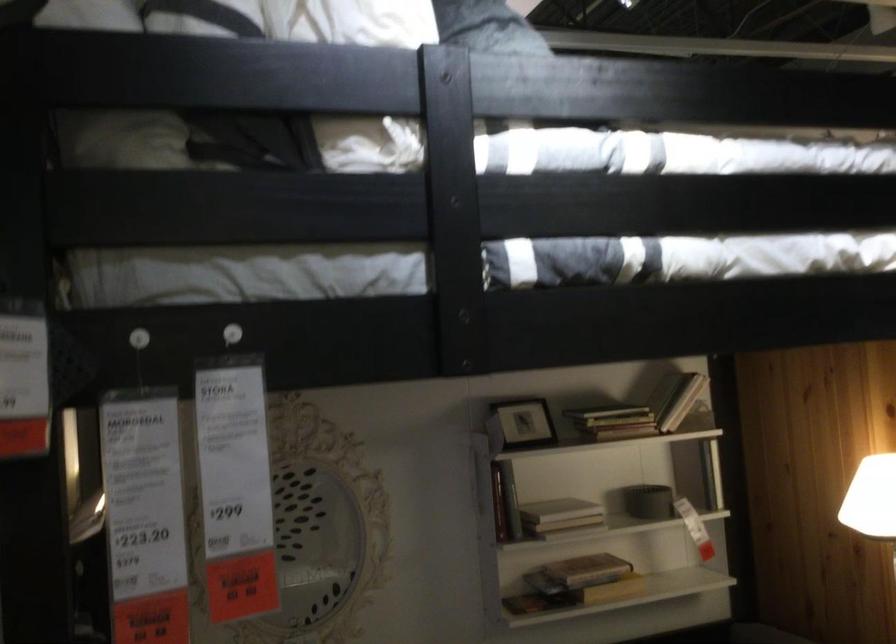
Find where to lift the black picture frame. Please return your answer as a coordinate pair (x, y).

(522, 422)